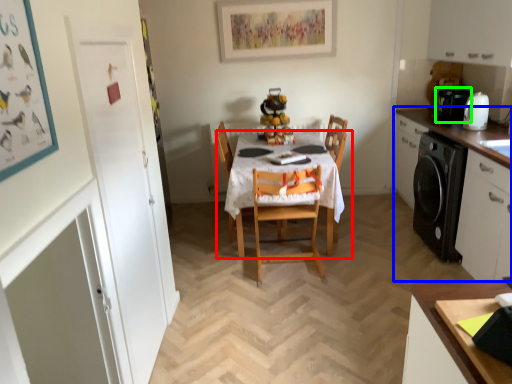
Question: Considering the real-world distances, which object is closest to kitchen & dining room table (highlighted by a red box)? cabinetry (highlighted by a blue box) or coffee machine (highlighted by a green box).

Choices:
 (A) cabinetry
 (B) coffee machine

Answer: (A)